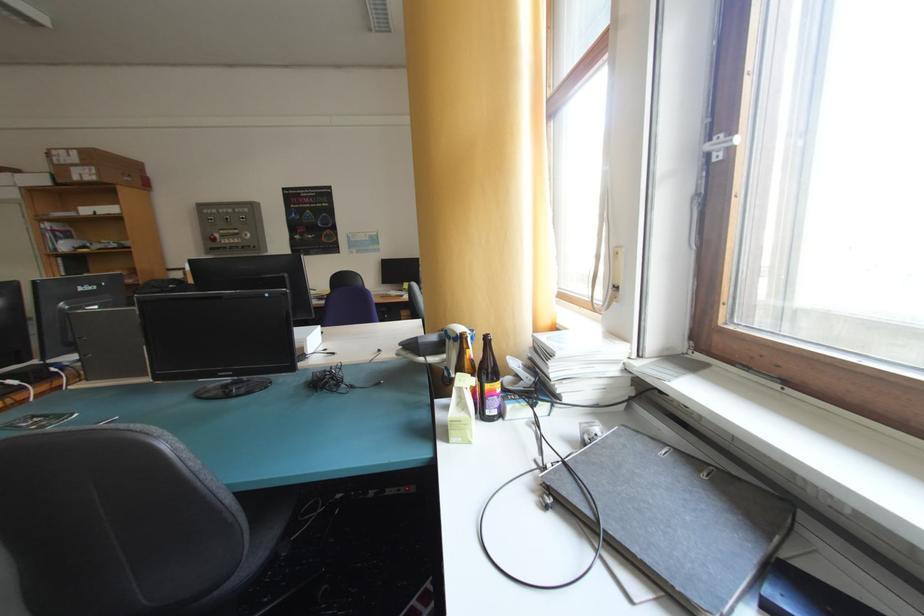
Where would you push the red panel button? Please return your answer as a coordinate pair (x, y).

(213, 237)